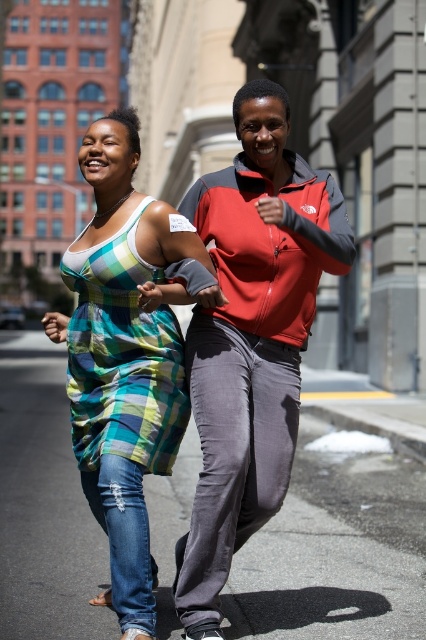
Question: Can you confirm if gray asphalt at center is smaller than plaid fabric dress at center?

Choices:
 (A) no
 (B) yes

Answer: (A)

Question: Among these points, which one is nearest to the camera?

Choices:
 (A) (158, 609)
 (B) (232, 333)

Answer: (B)

Question: In this image, where is gray asphalt at center located relative to plaid fabric dress at center?

Choices:
 (A) above
 (B) below

Answer: (B)

Question: Which of these objects is positioned farthest from the gray asphalt at center?

Choices:
 (A) plaid cotton dress at left
 (B) plaid fabric dress at center

Answer: (A)

Question: Which of the following is the closest to the observer?

Choices:
 (A) plaid fabric dress at center
 (B) gray asphalt at center

Answer: (A)

Question: Is gray asphalt at center smaller than plaid cotton dress at left?

Choices:
 (A) yes
 (B) no

Answer: (B)